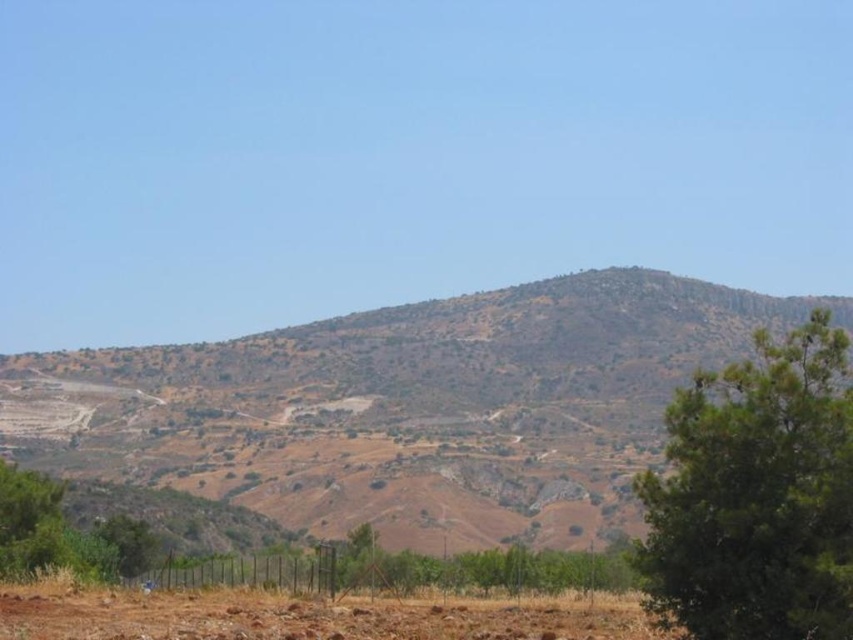
Does green textured tree at right have a lesser width compared to brown soil at lower center?

Yes, green textured tree at right is thinner than brown soil at lower center.

Is green textured tree at right behind brown soil at lower center?

No, it is in front of brown soil at lower center.

This screenshot has width=853, height=640. Describe the element at coordinates (756, 496) in the screenshot. I see `green textured tree at right` at that location.

Locate an element on the screen. This screenshot has height=640, width=853. green textured tree at right is located at coordinates (756, 496).

Is brown rocky mountain at center taller than green textured tree at right?

Yes, brown rocky mountain at center is taller than green textured tree at right.

Is point (519, 424) more distant than point (653, 609)?

Yes, point (519, 424) is farther from viewer.

Where is `brown rocky mountain at center`? brown rocky mountain at center is located at coordinates (405, 408).

You are a GUI agent. You are given a task and a screenshot of the screen. Output one action in this format:
    pyautogui.click(x=<x>, y=<y>)
    Task: Click on the brown rocky mountain at center
    
    Given the screenshot: What is the action you would take?
    pyautogui.click(x=405, y=408)

Based on the photo, is brown rocky mountain at center thinner than brown soil at lower center?

Incorrect, brown rocky mountain at center's width is not less than brown soil at lower center's.

Is point (672, 285) in front of point (78, 589)?

No, it is not.

Find the location of `brown rocky mountain at center`. brown rocky mountain at center is located at coordinates (405, 408).